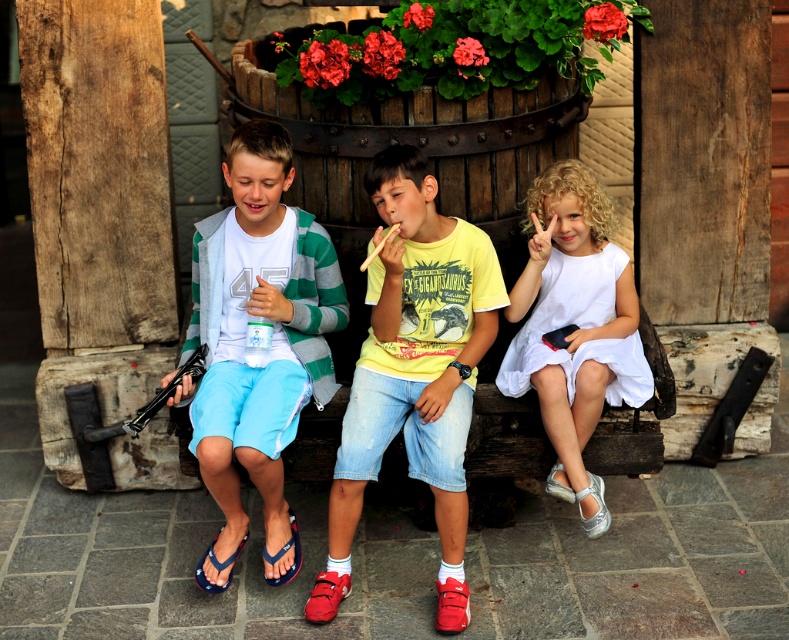
Based on the scene description, can you determine which object is taller between the white satin dress at right and the red suede sandal at lower center?

The white satin dress at right is taller than the red suede sandal at lower center according to the description.

You are a photographer trying to capture a group photo of the children. Since the white cotton shirt at center and the white satin dress at right are both white, you want to ensure they are positioned so that their clothing doesn not blend into each other. Based on their positions, which child should you ask to move forward slightly to create contrast?

The white cotton shirt at center should move forward slightly because it is located below the white satin dress at right, so moving it forward will create a clearer separation between the two white garments.

What is the position of the point with coordinates (417, 362) in the image?

The point with coordinates (417, 362) is on the yellow cotton shirt at center.